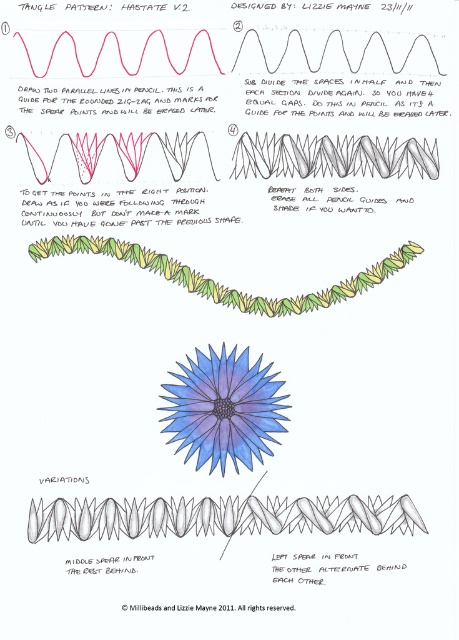
Which is in front, point (374, 504) or point (257, 416)?

Positioned in front is point (374, 504).

Measure the distance from gray pencil lines at lower center to blue matte flower at center.

gray pencil lines at lower center and blue matte flower at center are 3.75 inches apart from each other.

At what (x,y) coordinates should I click in order to perform the action: click on gray pencil lines at lower center. Please return your answer as a coordinate pair (x, y). The image size is (459, 640). Looking at the image, I should click on point(218,516).

Based on the photo, is gray pencil lines at lower center behind green grass-like at lower center?

No, it is not.

Between point (220, 504) and point (295, 307), which one is positioned behind?

The point (295, 307) is behind.

You are a GUI agent. You are given a task and a screenshot of the screen. Output one action in this format:
    pyautogui.click(x=<x>, y=<y>)
    Task: Click on the gray pencil lines at lower center
    The image size is (459, 640).
    Given the screenshot: What is the action you would take?
    pyautogui.click(x=218, y=516)

Who is positioned more to the right, blue matte flower at center or green grass-like at lower center?

green grass-like at lower center

Is point (233, 401) more distant than point (375, 282)?

Yes, point (233, 401) is farther from viewer.

Locate an element on the screen. This screenshot has width=459, height=640. blue matte flower at center is located at coordinates (223, 408).